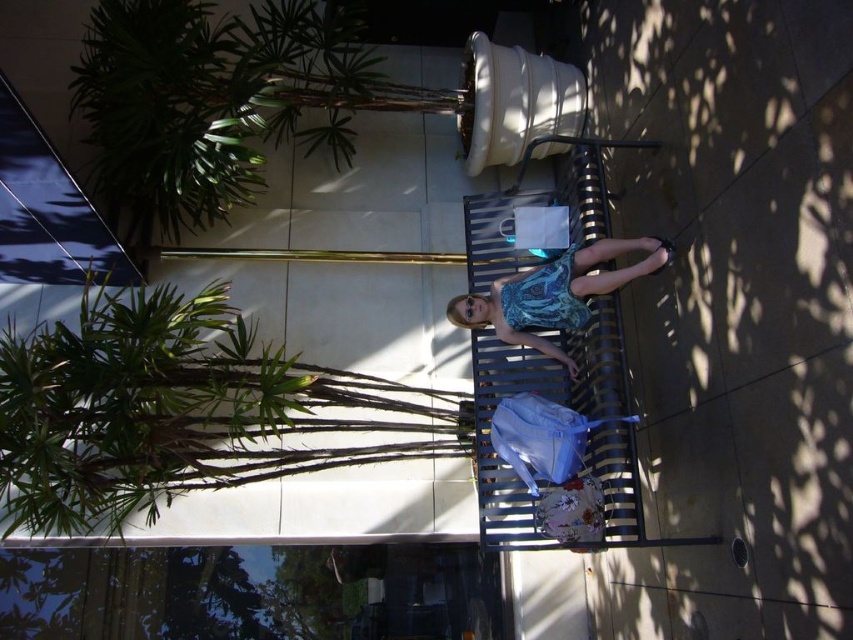
You are a photographer trying to capture the woman in the scene. Since both the printed fabric dress at center and the blue patterned fabric dress at center are present, which dress is closer to the camera?

The printed fabric dress at center is in front of the blue patterned fabric dress at center, so it is closer to the camera.